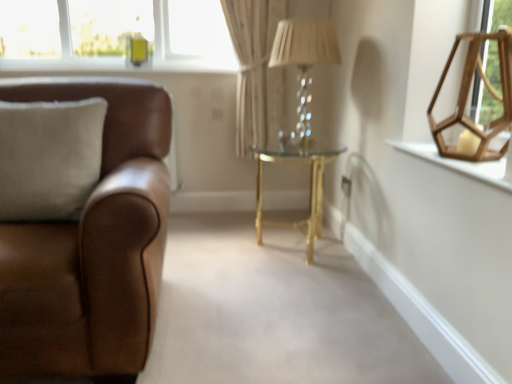
Question: Is wooden hexagonal frame at upper right outside of beige fabric curtain at center?

Choices:
 (A) yes
 (B) no

Answer: (A)

Question: From the image's perspective, is wooden hexagonal frame at upper right below beige fabric curtain at center?

Choices:
 (A) no
 (B) yes

Answer: (B)

Question: From a real-world perspective, is wooden hexagonal frame at upper right on beige fabric curtain at center?

Choices:
 (A) yes
 (B) no

Answer: (B)

Question: Can you confirm if wooden hexagonal frame at upper right is positioned to the right of beige fabric curtain at center?

Choices:
 (A) no
 (B) yes

Answer: (B)

Question: Is wooden hexagonal frame at upper right smaller than beige fabric curtain at center?

Choices:
 (A) yes
 (B) no

Answer: (A)

Question: Is wooden hexagonal frame at upper right oriented towards beige fabric curtain at center?

Choices:
 (A) no
 (B) yes

Answer: (A)

Question: Considering the relative sizes of wooden hexagonal frame at upper right and translucent glass table lamp at center in the image provided, is wooden hexagonal frame at upper right wider than translucent glass table lamp at center?

Choices:
 (A) yes
 (B) no

Answer: (B)

Question: Can you confirm if wooden hexagonal frame at upper right is positioned to the right of translucent glass table lamp at center?

Choices:
 (A) yes
 (B) no

Answer: (A)

Question: Are wooden hexagonal frame at upper right and translucent glass table lamp at center located far from each other?

Choices:
 (A) no
 (B) yes

Answer: (A)

Question: From a real-world perspective, is wooden hexagonal frame at upper right physically above translucent glass table lamp at center?

Choices:
 (A) no
 (B) yes

Answer: (A)

Question: Could you tell me if wooden hexagonal frame at upper right is facing translucent glass table lamp at center?

Choices:
 (A) no
 (B) yes

Answer: (A)

Question: Considering the relative sizes of wooden hexagonal frame at upper right and translucent glass table lamp at center in the image provided, is wooden hexagonal frame at upper right smaller than translucent glass table lamp at center?

Choices:
 (A) yes
 (B) no

Answer: (A)

Question: Considering the relative sizes of beige fabric curtain at center and translucent glass table lamp at center in the image provided, is beige fabric curtain at center smaller than translucent glass table lamp at center?

Choices:
 (A) no
 (B) yes

Answer: (A)